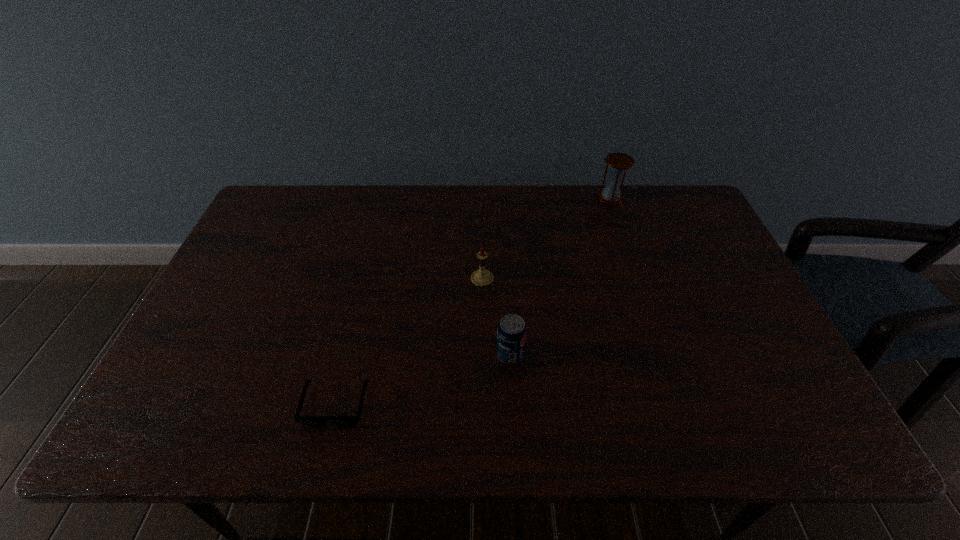
I want to click on object that stands as the third closest to the candle, so [x=618, y=163].

This screenshot has width=960, height=540. What are the coordinates of `vacant position in the image that satisfies the following two spatial constraints: 1. on the front side of the third object from right to left; 2. on the right side of the second nearest object` in the screenshot? It's located at (483, 354).

Where is `blank area in the image that satisfies the following two spatial constraints: 1. on the front side of the third nearest object; 2. on the left side of the third object from left to right`? blank area in the image that satisfies the following two spatial constraints: 1. on the front side of the third nearest object; 2. on the left side of the third object from left to right is located at coordinates (483, 354).